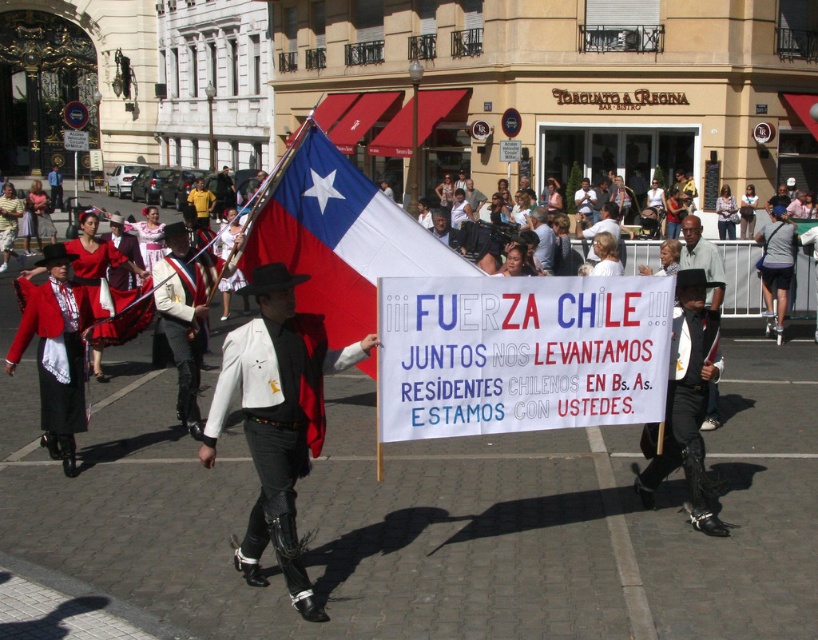
Does white matte vest at center appear on the right side of red satin dress at center?

Yes, white matte vest at center is to the right of red satin dress at center.

Does white matte vest at center have a larger size compared to red satin dress at center?

Correct, white matte vest at center is larger in size than red satin dress at center.

At what (x,y) coordinates should I click in order to perform the action: click on white matte vest at center. Please return your answer as a coordinate pair (x, y). This screenshot has height=640, width=818. Looking at the image, I should click on (277, 419).

Identify the location of white matte vest at center. The image size is (818, 640). (277, 419).

Who is more forward, (x=712, y=262) or (x=537, y=216)?

Point (x=712, y=262)

Is point (699, 230) positioned in front of point (533, 218)?

Yes, point (699, 230) is in front of point (533, 218).

In order to click on matte black cowboy hat at center in this screenshot , I will do `click(702, 259)`.

At what (x,y) coordinates should I click in order to perform the action: click on white paper banner at center. Please return your answer as a coordinate pair (x, y). The width and height of the screenshot is (818, 640). Looking at the image, I should click on (519, 353).

Is white paper banner at center further to camera compared to dark gray fabric pants at center?

No, white paper banner at center is closer to the viewer.

Between point (623, 422) and point (780, 298), which one is positioned behind?

Positioned behind is point (780, 298).

The height and width of the screenshot is (640, 818). What are the coordinates of `white paper banner at center` in the screenshot? It's located at (519, 353).